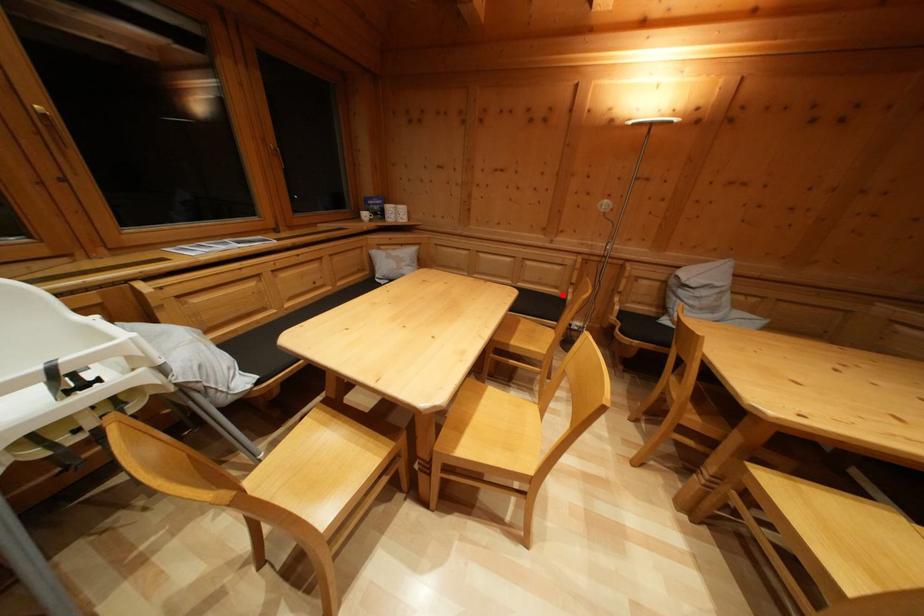
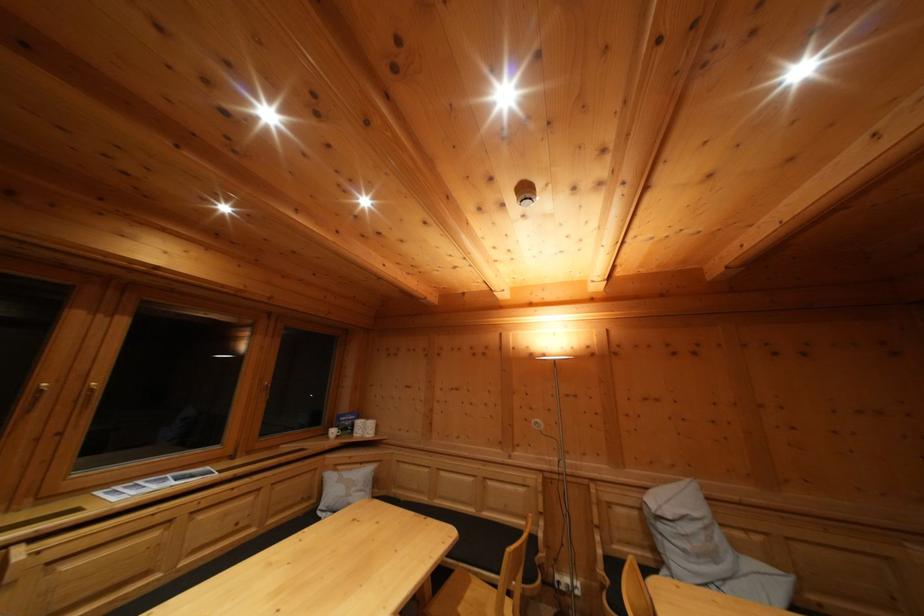
In the second image, find the point that corresponds to the highlighted location in the first image.

(532, 525)